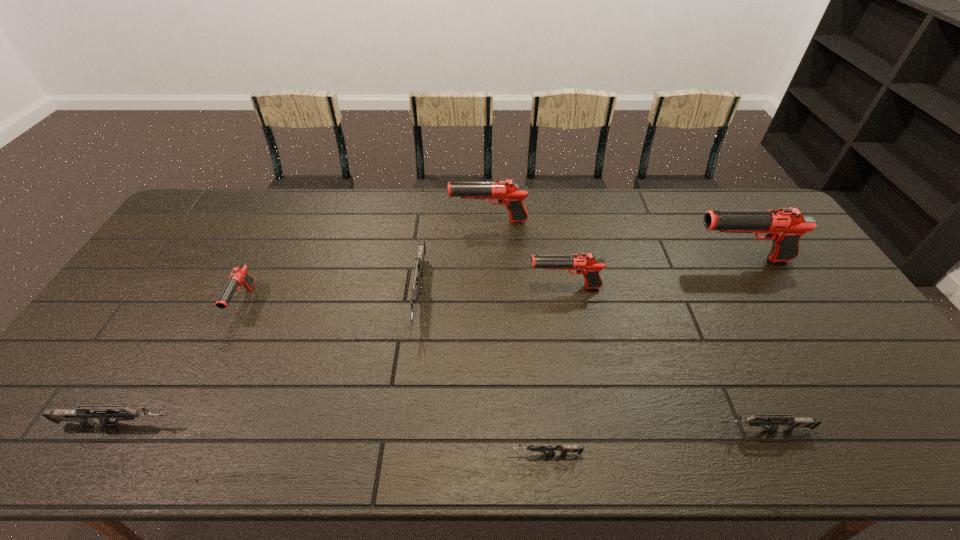
At what (x,y) coordinates should I click in order to perform the action: click on free space that satisfies the following two spatial constraints: 1. aimed along the barrel of the biggest grey gun; 2. aimed along the barrel of the sixth tallest object. Please return your answer as a coordinate pair (x, y). The height and width of the screenshot is (540, 960). Looking at the image, I should click on (402, 424).

Identify the location of free location that satisfies the following two spatial constraints: 1. at the aiming end of the second farthest black gun; 2. at the aiming end of the smallest black gun. (766, 302).

In order to click on vacant region that satisfies the following two spatial constraints: 1. aimed along the barrel of the third grey gun from right to left; 2. aimed along the barrel of the sixth tallest object in this screenshot , I will do `click(402, 424)`.

The width and height of the screenshot is (960, 540). Find the location of `vacant position in the image that satisfies the following two spatial constraints: 1. at the aiming end of the tallest object; 2. aimed along the barrel of the sixth object from right to left`. vacant position in the image that satisfies the following two spatial constraints: 1. at the aiming end of the tallest object; 2. aimed along the barrel of the sixth object from right to left is located at coordinates (760, 294).